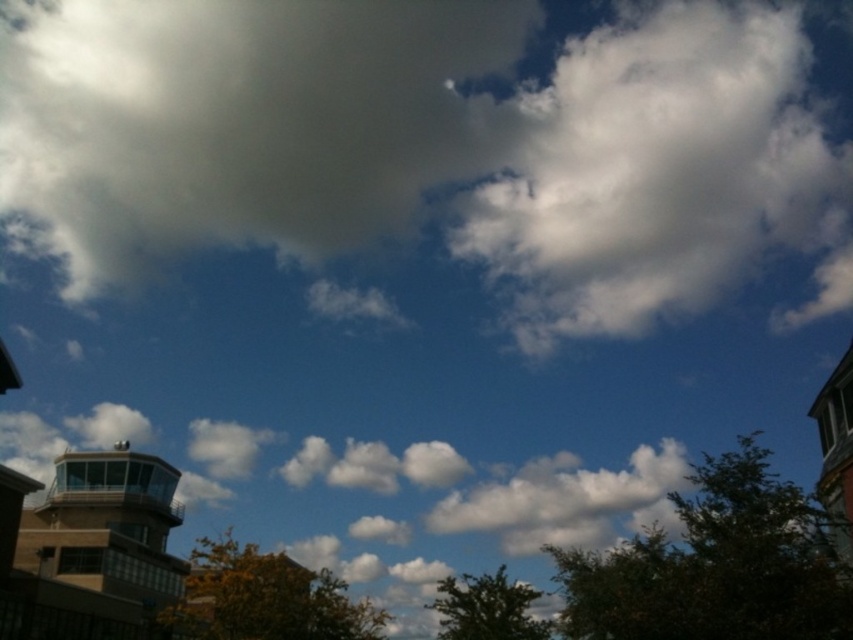
Is white fluffy cloud at upper center positioned in front of brown glass tower at lower left?

No, white fluffy cloud at upper center is behind brown glass tower at lower left.

Between point (312, 40) and point (131, 604), which one is positioned behind?

The point (312, 40) is behind.

I want to click on white fluffy cloud at upper center, so click(239, 124).

Is white fluffy cloud at upper right thinner than white fluffy cloud at center?

Incorrect, white fluffy cloud at upper right's width is not less than white fluffy cloud at center's.

Between white fluffy cloud at upper right and white fluffy cloud at center, which one has less height?

white fluffy cloud at center

You are a GUI agent. You are given a task and a screenshot of the screen. Output one action in this format:
    pyautogui.click(x=<x>, y=<y>)
    Task: Click on the white fluffy cloud at upper right
    
    Given the screenshot: What is the action you would take?
    pyautogui.click(x=664, y=173)

Measure the distance between white fluffy cloud at upper center and white fluffy cloud at center.

white fluffy cloud at upper center is 161.69 meters from white fluffy cloud at center.

Between point (50, 49) and point (662, 484), which one is positioned behind?

The point (50, 49) is more distant.

I want to click on white fluffy cloud at upper center, so click(239, 124).